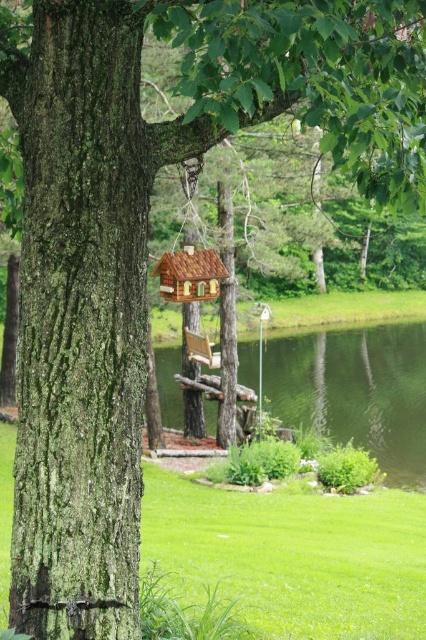
You are a gardener planning to plant flowers between the green mossy bark at center and the green grassy lake at center. Considering their sizes, which area would you choose for planting more flowers?

The green grassy lake at center is larger in size compared to the green mossy bark at center, so you should plant more flowers there.

You are a bird trying to reach the wooden swing at center from the green mossy bark at center. Which direction should you fly to get there?

The green mossy bark at center is located above the wooden swing at center, so you should fly downward to reach the wooden swing at center.

You are planning to place a new bench in the scene. The bench is 2 meters wide. You want to place it so that it doesn not block the view of the wooden swing at center. Based on the scene description, can the bench be placed at the green grassy lake at center without blocking the swing?

The green grassy lake at center is wider than the wooden swing at center. Since the bench is 2 meters wide, placing it at the lake would allow enough space to avoid blocking the swing as the lake provides a wider area.